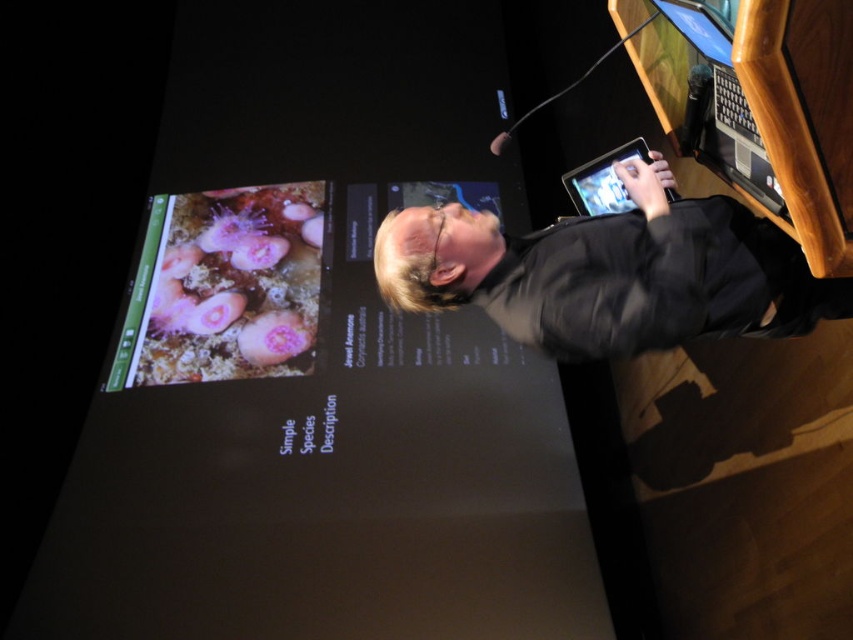
Question: Among these objects, which one is farthest from the camera?

Choices:
 (A) black matte shirt at center
 (B) black plastic laptop at upper right

Answer: (A)

Question: In this image, where is black matte shirt at center located relative to black plastic laptop at upper right?

Choices:
 (A) above
 (B) below

Answer: (B)

Question: In this image, where is black matte shirt at center located relative to black plastic laptop at upper right?

Choices:
 (A) right
 (B) left

Answer: (B)

Question: Which object appears farthest from the camera in this image?

Choices:
 (A) black matte shirt at center
 (B) black plastic laptop at upper right

Answer: (A)

Question: Can you confirm if black matte shirt at center is wider than black plastic laptop at upper right?

Choices:
 (A) no
 (B) yes

Answer: (B)

Question: Among these points, which one is farthest from the camera?

Choices:
 (A) (654, 70)
 (B) (521, 284)

Answer: (A)